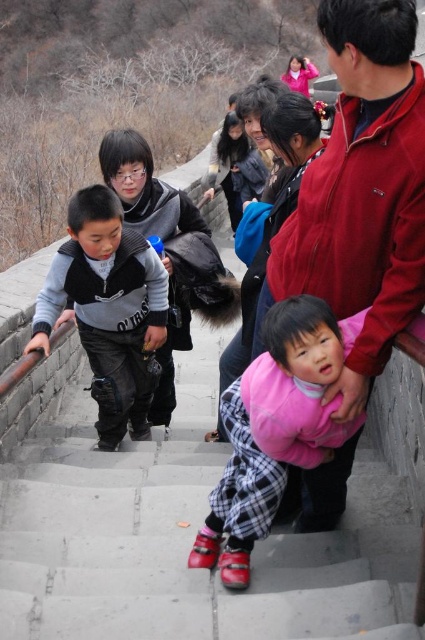
Does smooth concrete stairs at center appear over gray fleece vest at left?

Actually, smooth concrete stairs at center is below gray fleece vest at left.

Is point (25, 554) more distant than point (107, 218)?

No, it is in front of (107, 218).

Image resolution: width=425 pixels, height=640 pixels. Identify the location of smooth concrete stairs at center. click(184, 541).

Can you confirm if smooth concrete stairs at center is smaller than pink fleece jacket at center?

Indeed, smooth concrete stairs at center has a smaller size compared to pink fleece jacket at center.

Is point (5, 490) positioned after point (218, 529)?

Yes, point (5, 490) is behind point (218, 529).

Which is behind, point (101, 624) or point (283, 316)?

The point (283, 316) is behind.

The height and width of the screenshot is (640, 425). Find the location of `smooth concrete stairs at center`. smooth concrete stairs at center is located at coordinates (x=184, y=541).

Is pink fleece jacket at center shorter than gray fleece vest at left?

Correct, pink fleece jacket at center is not as tall as gray fleece vest at left.

Between pink fleece jacket at center and gray fleece vest at left, which one appears on the left side from the viewer's perspective?

gray fleece vest at left is more to the left.

Is point (243, 580) closer to viewer compared to point (153, 253)?

Yes, point (243, 580) is closer to viewer.

Locate an element on the screen. The image size is (425, 640). pink fleece jacket at center is located at coordinates (274, 429).